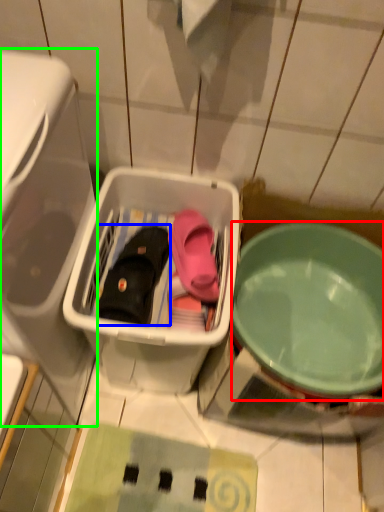
Question: Which is farther away from bowl (highlighted by a red box)? footwear (highlighted by a blue box) or dish washer (highlighted by a green box)?

Choices:
 (A) footwear
 (B) dish washer

Answer: (B)